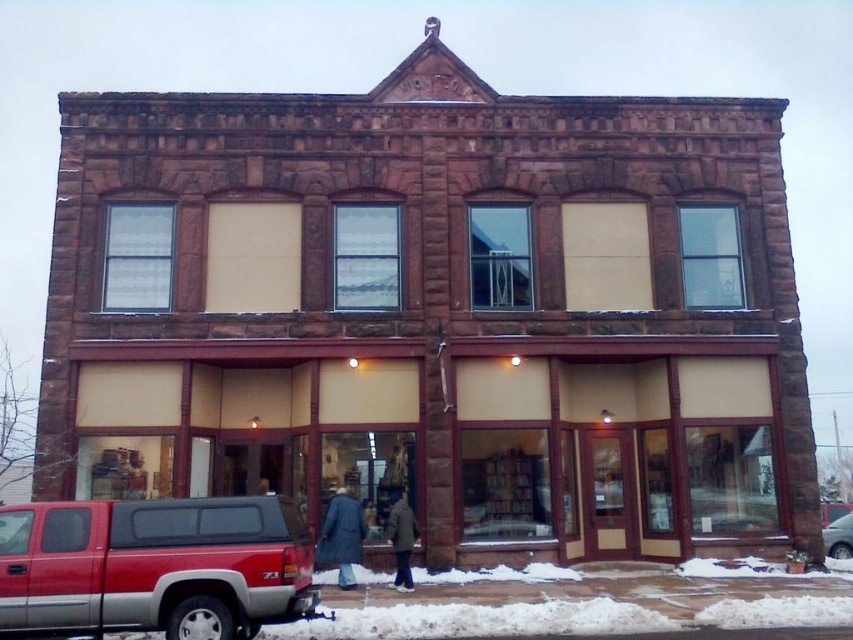
Question: Observing the image, what is the correct spatial positioning of red metallic pickup truck at lower left in reference to dark blue coat at center?

Choices:
 (A) below
 (B) above

Answer: (B)

Question: Considering the relative positions of dark brown leather coat at center and metallic silver car at lower right in the image provided, where is dark brown leather coat at center located with respect to metallic silver car at lower right?

Choices:
 (A) below
 (B) above

Answer: (B)

Question: Among these objects, which one is farthest from the camera?

Choices:
 (A) metallic silver car at lower right
 (B) red metallic pickup truck at lower left
 (C) dark blue coat at center

Answer: (A)

Question: Which point is closer to the camera?

Choices:
 (A) dark brown leather coat at center
 (B) red metallic pickup truck at lower left
 (C) dark blue coat at center
 (D) metallic silver car at lower right

Answer: (B)

Question: Does dark brown leather coat at center have a smaller size compared to metallic silver car at lower right?

Choices:
 (A) yes
 (B) no

Answer: (A)

Question: Estimate the real-world distances between objects in this image. Which object is closer to the metallic silver car at lower right?

Choices:
 (A) dark blue coat at center
 (B) red metallic pickup truck at lower left
 (C) dark brown leather coat at center

Answer: (C)